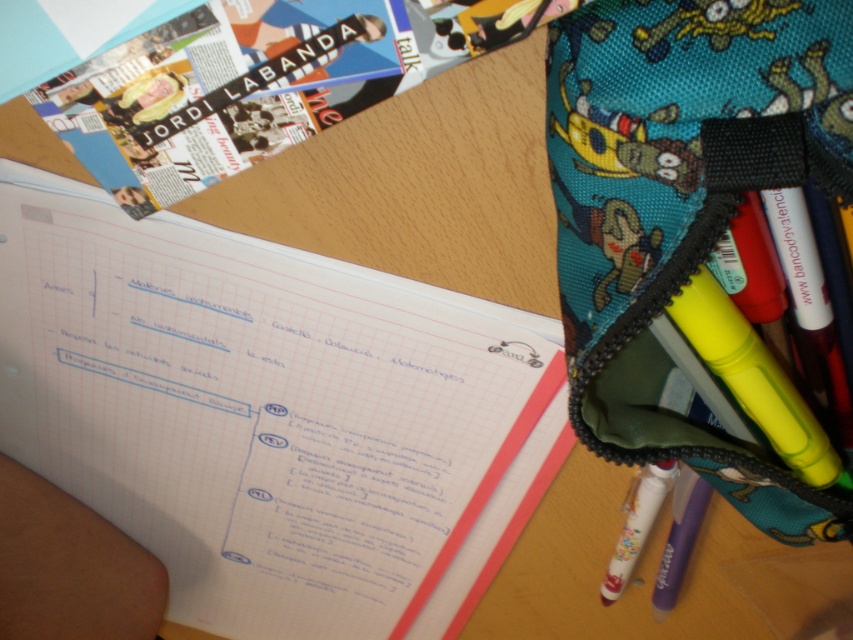
You are a student who needs to locate your teal fabric pencil case at right on your desk. Based on the coordinates provided, can you tell me what quadrant of the desk surface it occupies?

The teal fabric pencil case at right is located at coordinates point (683,205). Since both the x and y values are between 0 and 1, it is in the first quadrant of the desk surface.

Based on the photo, you are organizing your desk and need to place both the teal fabric pencil case at right and the white matte pen at lower right into a drawer. The drawer has a height limit of 5 cm. Which item might not fit if placed vertically?

The teal fabric pencil case at right has a greater height compared to the white matte pen at lower right. If placed vertically, the teal fabric pencil case at right might not fit in the drawer due to its greater height exceeding the 5 cm limit.